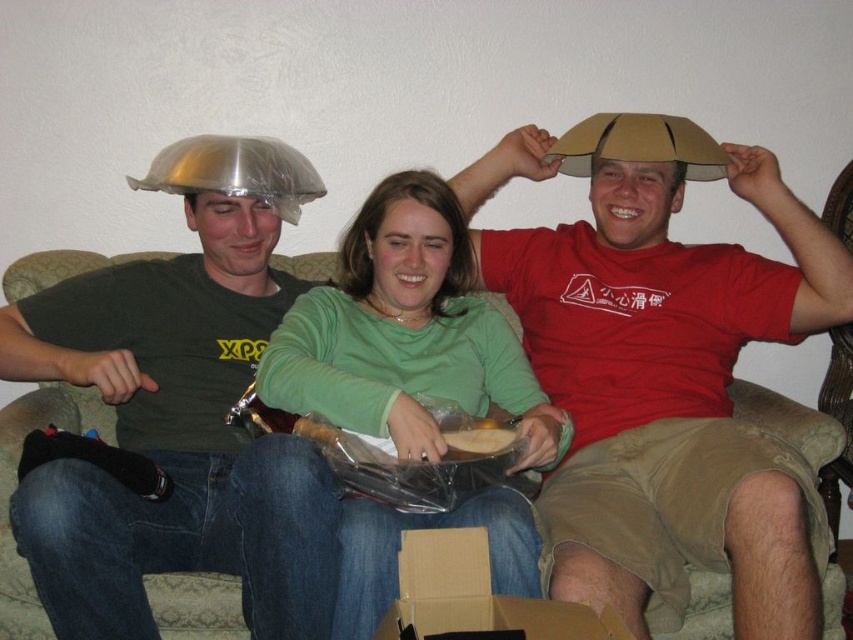
Which is in front, point (764, 611) or point (461, 435)?

Point (764, 611) is more forward.

Is matte cardboard hat at upper center shorter than translucent plastic bag at center?

In fact, matte cardboard hat at upper center may be taller than translucent plastic bag at center.

The image size is (853, 640). I want to click on matte cardboard hat at upper center, so click(670, 392).

Locate an element on the screen. matte cardboard hat at upper center is located at coordinates (670, 392).

Does matte cardboard hat at upper center have a lesser width compared to matte black shirt at left?

No.

Which is below, matte cardboard hat at upper center or matte black shirt at left?

Positioned lower is matte black shirt at left.

Does point (596, 218) come farther from viewer compared to point (296, 173)?

No.

This screenshot has height=640, width=853. Identify the location of matte cardboard hat at upper center. [x=670, y=392].

Which is more to the left, matte black shirt at left or translucent plastic bag at center?

From the viewer's perspective, matte black shirt at left appears more on the left side.

Who is more distant from viewer, (302, 531) or (480, 454)?

Point (480, 454)

Between point (184, 420) and point (473, 426), which one is positioned behind?

The point (184, 420) is behind.

The height and width of the screenshot is (640, 853). Find the location of `matte black shirt at left`. matte black shirt at left is located at coordinates (178, 412).